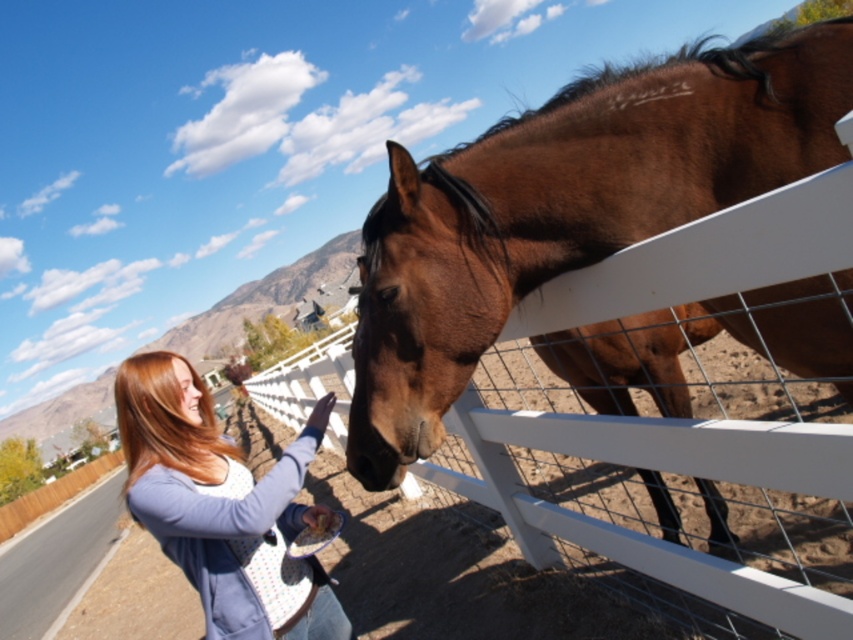
Question: Is brown glossy horse at center smaller than matte blue sweater at lower left?

Choices:
 (A) no
 (B) yes

Answer: (A)

Question: Among these points, which one is nearest to the camera?

Choices:
 (A) (514, 268)
 (B) (201, 445)

Answer: (A)

Question: Which of the following is the closest to the observer?

Choices:
 (A) matte blue sweater at lower left
 (B) brown glossy horse at center

Answer: (B)

Question: Does brown glossy horse at center have a greater width compared to matte blue sweater at lower left?

Choices:
 (A) yes
 (B) no

Answer: (A)

Question: Considering the relative positions of brown glossy horse at center and matte blue sweater at lower left in the image provided, where is brown glossy horse at center located with respect to matte blue sweater at lower left?

Choices:
 (A) left
 (B) right

Answer: (B)

Question: Which point is farther to the camera?

Choices:
 (A) matte blue sweater at lower left
 (B) brown glossy horse at center

Answer: (A)